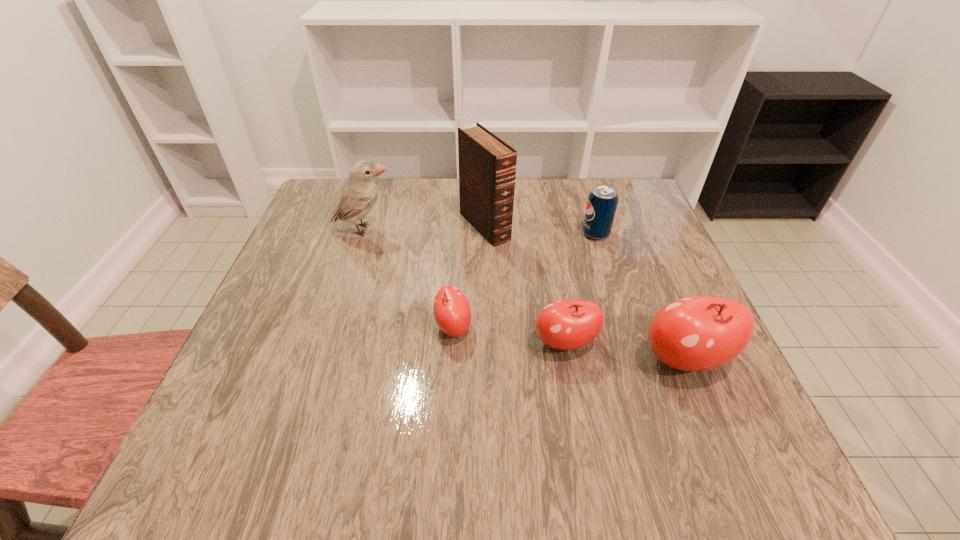
Image resolution: width=960 pixels, height=540 pixels. What are the coordinates of `vacant area that lies between the second tallest apple and the Bible` in the screenshot? It's located at (525, 285).

You are a GUI agent. You are given a task and a screenshot of the screen. Output one action in this format:
    pyautogui.click(x=<x>, y=<y>)
    Task: Click on the free space that is in between the soda can and the tallest object
    This screenshot has height=540, width=960.
    Given the screenshot: What is the action you would take?
    [540, 230]

I want to click on free area in between the tallest object and the leftmost apple, so click(x=469, y=277).

Find the location of a particular element. This screenshot has width=960, height=540. vacant area that lies between the leftmost object and the rightmost apple is located at coordinates (524, 295).

The image size is (960, 540). In order to click on vacant area that lies between the soda can and the rightmost apple in this screenshot , I will do `click(640, 297)`.

At what (x,y) coordinates should I click in order to perform the action: click on empty space between the second shortest apple and the tallest apple. Please return your answer as a coordinate pair (x, y). The image size is (960, 540). Looking at the image, I should click on (625, 352).

Image resolution: width=960 pixels, height=540 pixels. Find the location of `free space that is in between the soda can and the Bible`. free space that is in between the soda can and the Bible is located at coordinates (540, 230).

This screenshot has height=540, width=960. Identify the location of empty space that is in between the shortest apple and the soda can. (524, 281).

You are a GUI agent. You are given a task and a screenshot of the screen. Output one action in this format:
    pyautogui.click(x=<x>, y=<y>)
    Task: Click on the free space between the soda can and the second shortest apple
    
    Given the screenshot: What is the action you would take?
    pyautogui.click(x=581, y=288)

Image resolution: width=960 pixels, height=540 pixels. What are the coordinates of `unoccupied position between the Bible and the leftmost apple` in the screenshot? It's located at (469, 277).